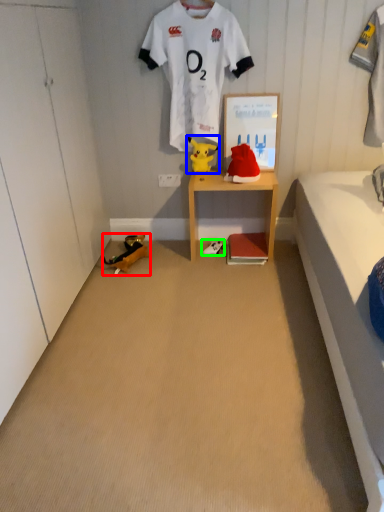
Question: Which object is positioned closest to toy (highlighted by a red box)? Select from toy (highlighted by a blue box) and footwear (highlighted by a green box).

Choices:
 (A) toy
 (B) footwear

Answer: (B)